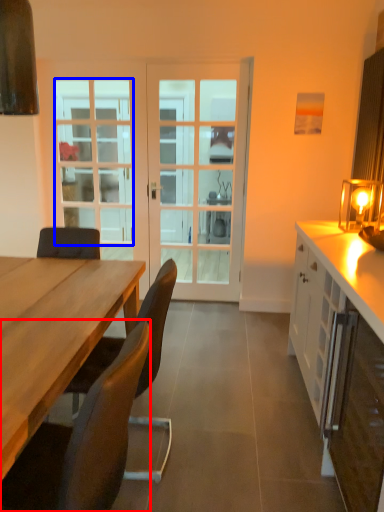
Question: Which object appears closest to the camera in this image, chair (highlighted by a red box) or window (highlighted by a blue box)?

Choices:
 (A) chair
 (B) window

Answer: (A)